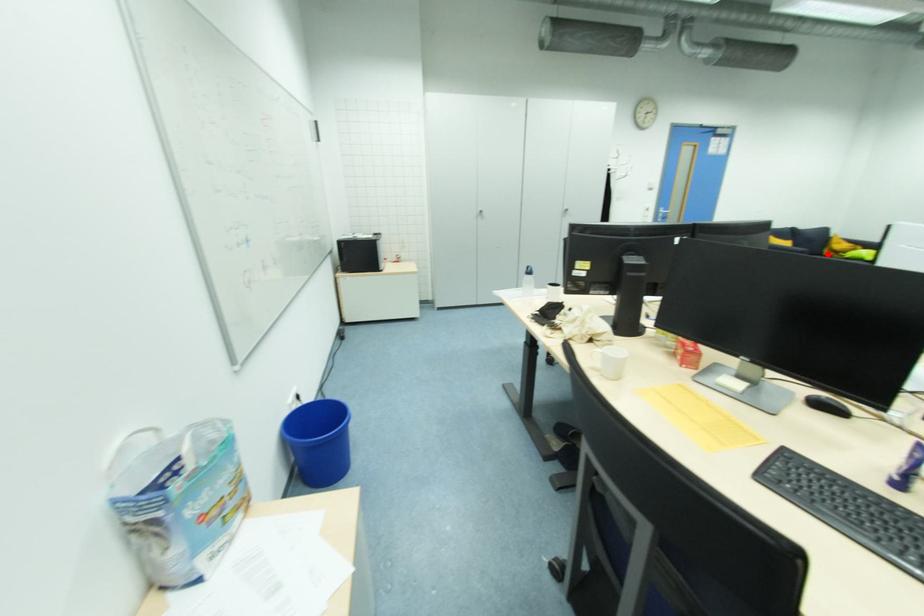
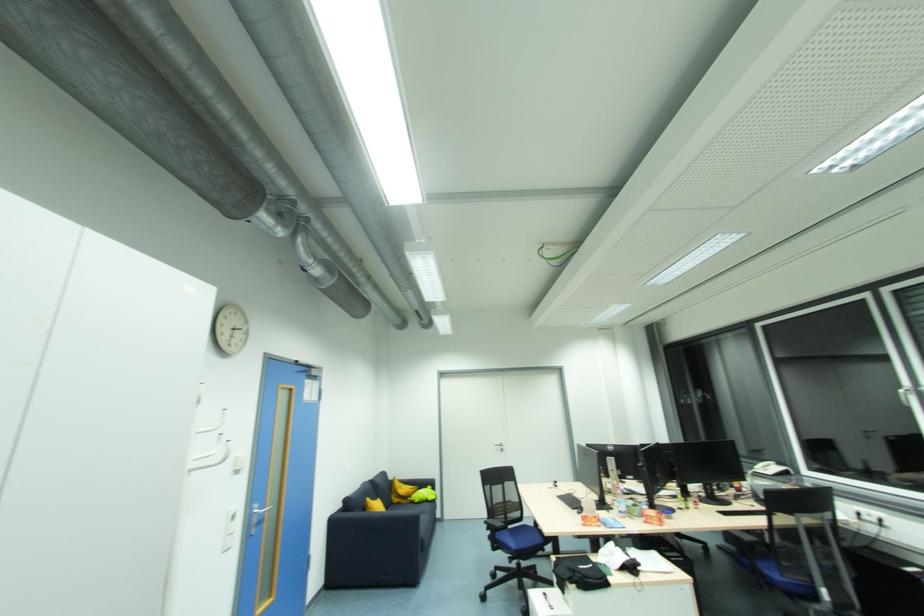
Find the pixel in the second image that matches the highlighted location in the first image.

(397, 501)